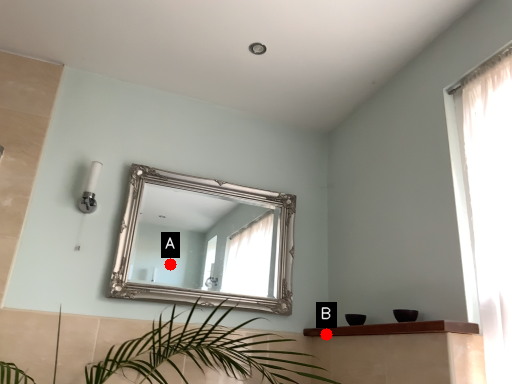
Question: Two points are circled on the image, labeled by A and B beside each circle. Which point is farther from the camera taking this photo?

Choices:
 (A) A is further
 (B) B is further

Answer: (A)